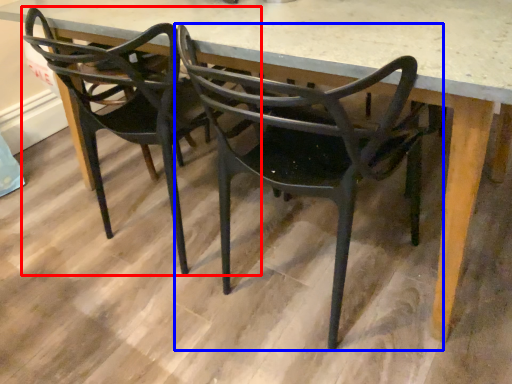
Question: Which object appears farthest to the camera in this image, chair (highlighted by a red box) or chair (highlighted by a blue box)?

Choices:
 (A) chair
 (B) chair

Answer: (A)